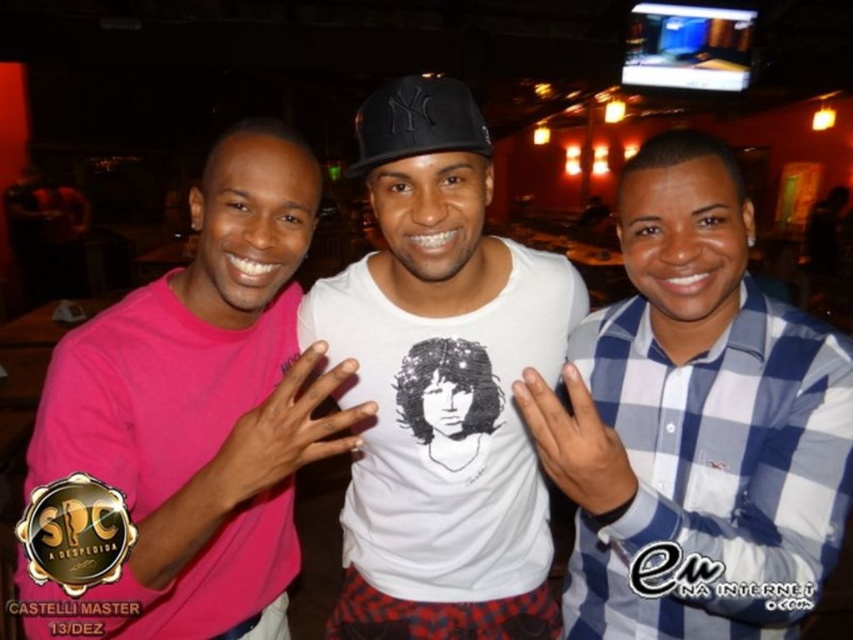
Is point (714, 518) behind point (347, 172)?

No, (714, 518) is closer to viewer.

Does blue checkered shirt at center have a larger size compared to black matte baseball cap at center?

A: Correct, blue checkered shirt at center is larger in size than black matte baseball cap at center.

Who is more distant from viewer, (635, 483) or (375, 160)?

The point (375, 160) is behind.

In order to click on blue checkered shirt at center in this screenshot , I will do `click(695, 422)`.

In the scene shown: Does pink matte t-shirt at left appear under white cotton t-shirt at center?

Yes, pink matte t-shirt at left is below white cotton t-shirt at center.

Can you confirm if pink matte t-shirt at left is smaller than white cotton t-shirt at center?

Actually, pink matte t-shirt at left might be larger than white cotton t-shirt at center.

Between point (120, 612) and point (318, 280), which one is positioned in front?

Point (120, 612) is more forward.

Image resolution: width=853 pixels, height=640 pixels. What are the coordinates of `pink matte t-shirt at left` in the screenshot? It's located at (186, 426).

Is blue checkered shirt at center closer to the viewer compared to white cotton t-shirt at center?

That is True.

Which is in front, point (786, 572) or point (407, 368)?

Positioned in front is point (786, 572).

The height and width of the screenshot is (640, 853). In order to click on blue checkered shirt at center in this screenshot , I will do `click(695, 422)`.